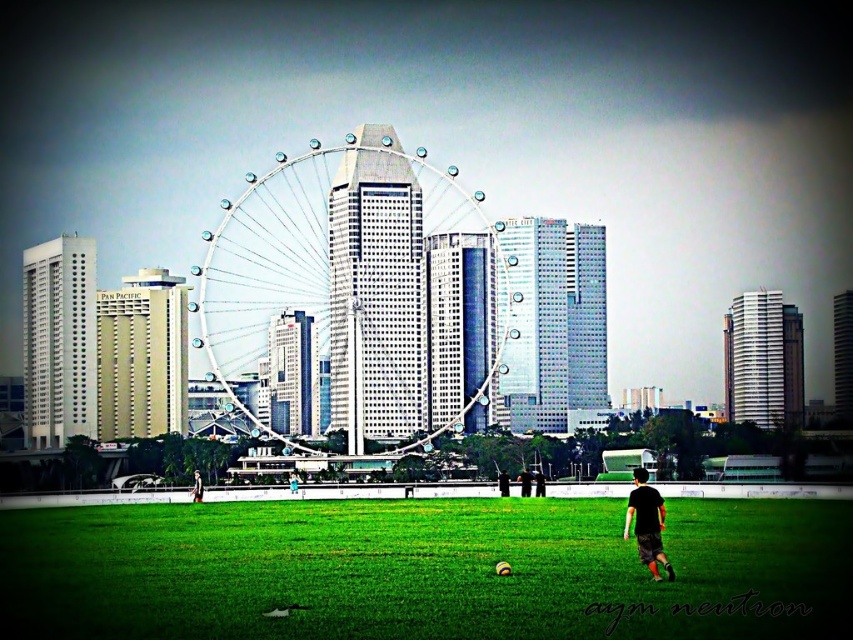
You are standing on the grassy field and want to take a photo of the metallic silver ferris wheel at center without any obstructions. Is the black matte shirt at lower right blocking your view of the ferris wheel?

The metallic silver ferris wheel at center is in front of the black matte shirt at lower right, so the shirt is not blocking the view of the ferris wheel.

You are a photographer trying to capture the Singapore Flyer in your shot. You have a camera with a standard lens that can focus on objects up to 100 meters away. The metallic silver ferris wheel at center is 150 meters away from your current position. Can you still include the black fabric shirt at lower center in the frame if you want to focus on the Singapore Flyer?

The metallic silver ferris wheel at center is bigger than the black fabric shirt at lower center, but since the Ferris wheel is 150 meters away and your lens can only focus up to 100 meters, you won size focus on the Singapore Flyer. However, the black fabric shirt at lower center is closer and within the 100 meter range, so it can be included in the frame but will not be the main focus.

You are standing on the grassy field and want to take a photo of the metallic silver ferris wheel at center without the black matte shirt at lower right appearing in the frame. Is it possible to do so by moving to the side?

The metallic silver ferris wheel at center is positioned over the black matte shirt at lower right, so moving to the side might not be sufficient to exclude the shirt from the frame. You might need to adjust your angle or distance to ensure the shirt is out of view.